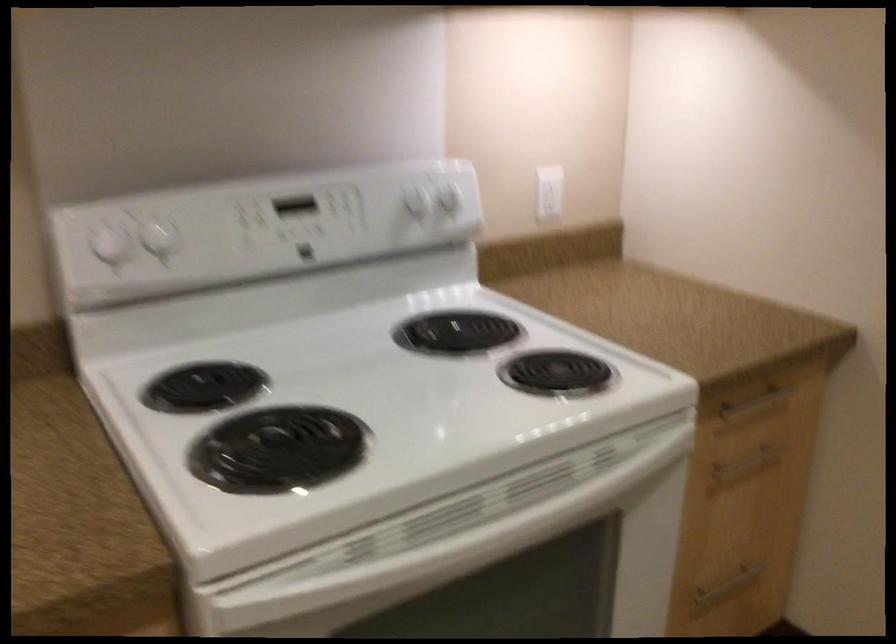
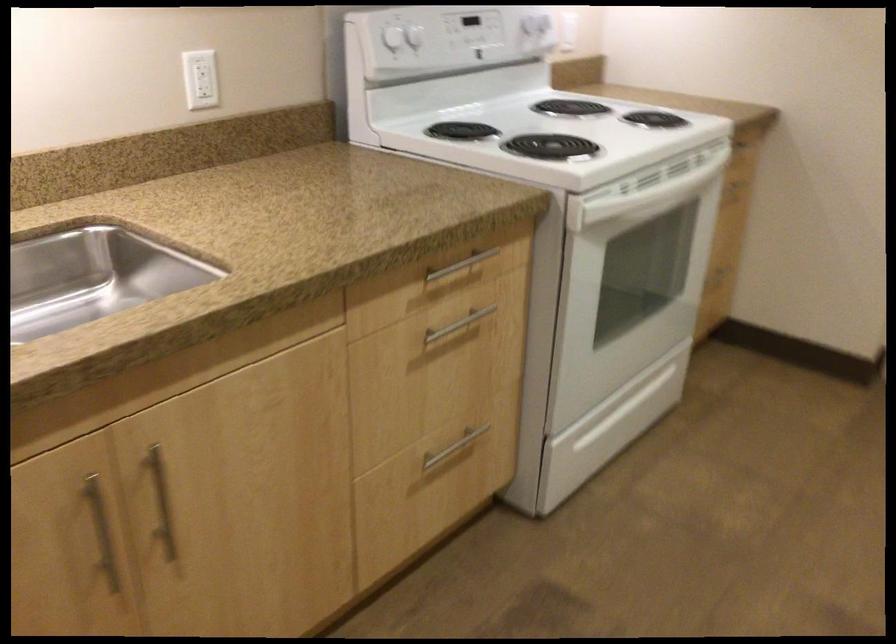
Where in the second image is the point corresponding to (x=409, y=561) from the first image?

(645, 196)